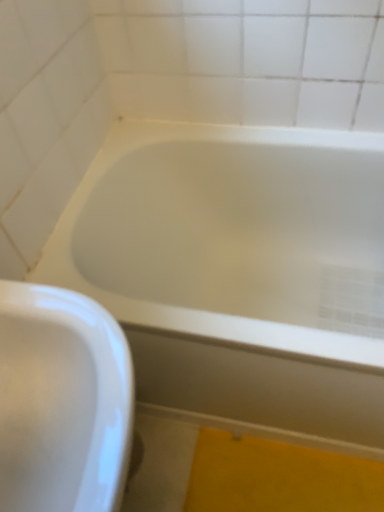
Question: Based on their sizes in the image, would you say white glossy sink at lower left is bigger or smaller than white glossy bathtub at center?

Choices:
 (A) big
 (B) small

Answer: (B)

Question: From a real-world perspective, relative to white glossy bathtub at center, is white glossy sink at lower left vertically above or below?

Choices:
 (A) below
 (B) above

Answer: (B)

Question: Based on their positions, is white glossy sink at lower left located to the left or right of white glossy bathtub at center?

Choices:
 (A) left
 (B) right

Answer: (A)

Question: In terms of width, does white glossy bathtub at center look wider or thinner when compared to white glossy sink at lower left?

Choices:
 (A) wide
 (B) thin

Answer: (A)

Question: In the image, is white glossy bathtub at center positioned in front of or behind white glossy sink at lower left?

Choices:
 (A) front
 (B) behind

Answer: (B)

Question: From a real-world perspective, relative to white glossy sink at lower left, is white glossy bathtub at center vertically above or below?

Choices:
 (A) below
 (B) above

Answer: (A)

Question: In terms of size, does white glossy bathtub at center appear bigger or smaller than white glossy sink at lower left?

Choices:
 (A) small
 (B) big

Answer: (B)